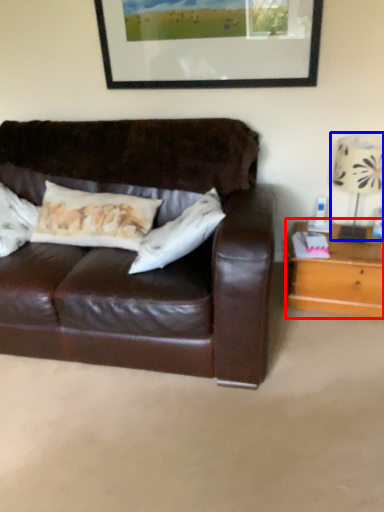
Question: Which object is closer to the camera taking this photo, table (highlighted by a red box) or table lamp (highlighted by a blue box)?

Choices:
 (A) table
 (B) table lamp

Answer: (B)